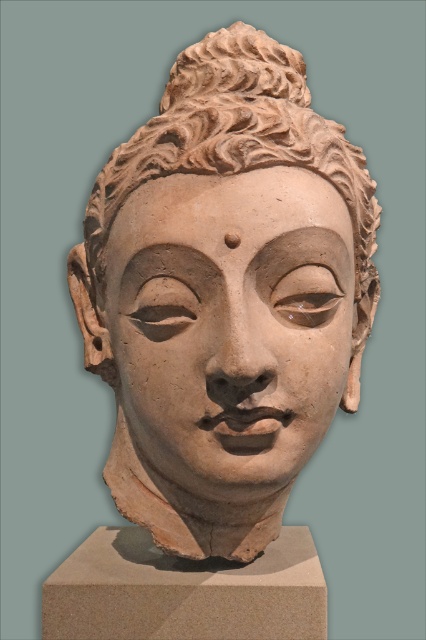
Question: Is matte clay head at center positioned behind matte clay face at center?

Choices:
 (A) yes
 (B) no

Answer: (A)

Question: Does matte clay head at center have a greater width compared to matte clay face at center?

Choices:
 (A) no
 (B) yes

Answer: (B)

Question: Among these objects, which one is nearest to the camera?

Choices:
 (A) matte clay head at center
 (B) matte clay face at center

Answer: (B)

Question: Can you confirm if matte clay head at center is bigger than matte clay face at center?

Choices:
 (A) yes
 (B) no

Answer: (A)